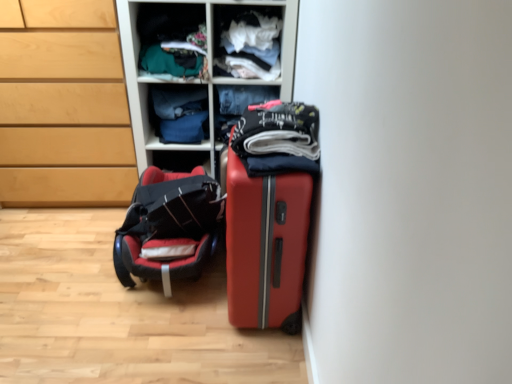
Locate an element on the screen. Image resolution: width=512 pixels, height=384 pixels. vacant space situated on the left part of black leather baby car seat at lower left is located at coordinates (63, 254).